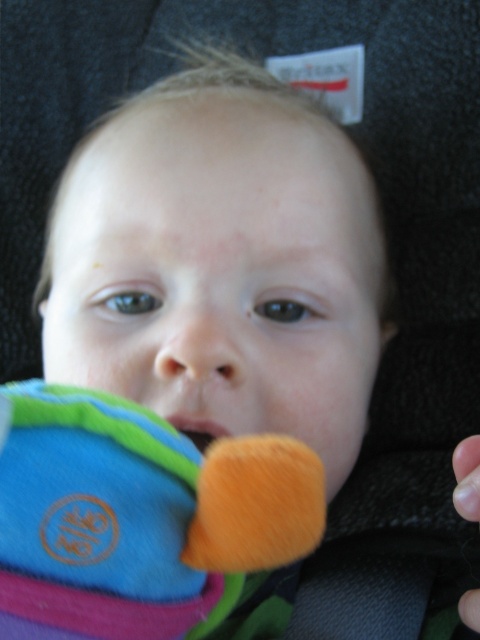
Which is below, soft plush toy at lower left or matte orange mouth at center?

Positioned lower is soft plush toy at lower left.

Identify the location of soft plush toy at lower left. Image resolution: width=480 pixels, height=640 pixels. (145, 522).

Describe the element at coordinates (145, 522) in the screenshot. The height and width of the screenshot is (640, 480). I see `soft plush toy at lower left` at that location.

Locate an element on the screen. Image resolution: width=480 pixels, height=640 pixels. soft plush toy at lower left is located at coordinates (145, 522).